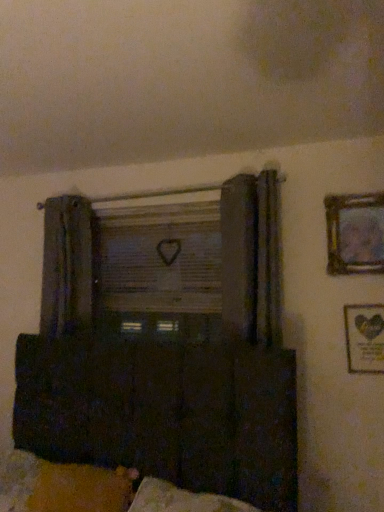
Question: Considering the relative sizes of velvety yellow pillow at lower left and wooden framed picture at lower right, which is counted as the first picture frame, starting from the bottom, in the image provided, is velvety yellow pillow at lower left bigger than wooden framed picture at lower right, which is counted as the first picture frame, starting from the bottom,?

Choices:
 (A) no
 (B) yes

Answer: (B)

Question: Is velvety yellow pillow at lower left in contact with wooden framed picture at lower right, placed as the 2th picture frame when sorted from top to bottom?

Choices:
 (A) yes
 (B) no

Answer: (B)

Question: Would you say velvety yellow pillow at lower left is a long distance from wooden framed picture at lower right, which is counted as the first picture frame, starting from the bottom?

Choices:
 (A) no
 (B) yes

Answer: (B)

Question: Is velvety yellow pillow at lower left outside wooden framed picture at lower right, which is counted as the first picture frame, starting from the bottom?

Choices:
 (A) yes
 (B) no

Answer: (A)

Question: From a real-world perspective, is velvety yellow pillow at lower left beneath wooden framed picture at lower right, placed as the 2th picture frame when sorted from top to bottom?

Choices:
 (A) yes
 (B) no

Answer: (A)

Question: Is velvety yellow pillow at lower left positioned with its back to wooden framed picture at lower right, which is counted as the first picture frame, starting from the bottom?

Choices:
 (A) yes
 (B) no

Answer: (B)

Question: Is wooden picture frame at upper right, arranged as the first picture frame when viewed from the top, at the left side of wooden framed picture at lower right, which is counted as the first picture frame, starting from the bottom?

Choices:
 (A) yes
 (B) no

Answer: (A)

Question: Does wooden picture frame at upper right, arranged as the first picture frame when viewed from the top, have a greater height compared to wooden framed picture at lower right, which is counted as the first picture frame, starting from the bottom?

Choices:
 (A) no
 (B) yes

Answer: (B)

Question: From a real-world perspective, does wooden picture frame at upper right, arranged as the first picture frame when viewed from the top, stand above wooden framed picture at lower right, which is counted as the first picture frame, starting from the bottom?

Choices:
 (A) no
 (B) yes

Answer: (B)

Question: From a real-world perspective, is wooden picture frame at upper right, arranged as the first picture frame when viewed from the top, below wooden framed picture at lower right, placed as the 2th picture frame when sorted from top to bottom?

Choices:
 (A) yes
 (B) no

Answer: (B)

Question: Does wooden picture frame at upper right, arranged as the first picture frame when viewed from the top, have a lesser height compared to wooden framed picture at lower right, which is counted as the first picture frame, starting from the bottom?

Choices:
 (A) no
 (B) yes

Answer: (A)

Question: Is wooden picture frame at upper right, arranged as the first picture frame when viewed from the top, facing towards wooden framed picture at lower right, which is counted as the first picture frame, starting from the bottom?

Choices:
 (A) yes
 (B) no

Answer: (B)

Question: From a real-world perspective, is dark wood cabinet at lower center on top of wooden framed picture at lower right, placed as the 2th picture frame when sorted from top to bottom?

Choices:
 (A) yes
 (B) no

Answer: (B)